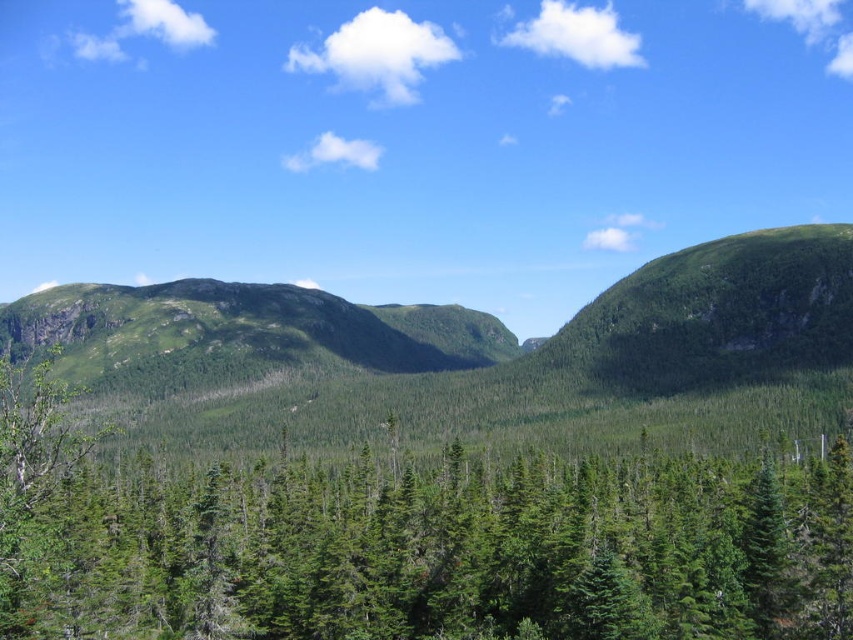
Does green matte tree at center lie in front of green grassy mountain at center?

Yes, it is.

Measure the distance between green matte tree at center and green grassy mountain at center.

213.60 feet

The image size is (853, 640). Find the location of `green matte tree at center`. green matte tree at center is located at coordinates (412, 541).

The height and width of the screenshot is (640, 853). Identify the location of green matte tree at center. (412, 541).